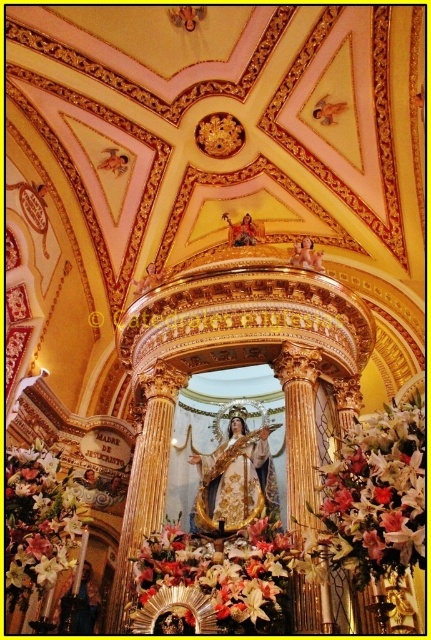
Who is positioned more to the right, floral bouquet at center or white silk flower at lower left?

floral bouquet at center is more to the right.

Who is more distant from viewer, (159, 600) or (53, 577)?

The point (53, 577) is behind.

Find the location of a particular element. The height and width of the screenshot is (640, 431). floral bouquet at center is located at coordinates (x=214, y=580).

Is white silk flowers at right bigger than floral bouquet at center?

Indeed, white silk flowers at right has a larger size compared to floral bouquet at center.

How far apart are white silk flowers at right and floral bouquet at center?

A distance of 10.12 meters exists between white silk flowers at right and floral bouquet at center.

Measure the distance between white silk flowers at right and camera.

white silk flowers at right is 34.71 meters from camera.

In order to click on white silk flowers at right in this screenshot , I will do `click(377, 493)`.

Is white silk flowers at right further to the viewer compared to white silk flower at lower left?

No, it is in front of white silk flower at lower left.

Image resolution: width=431 pixels, height=640 pixels. I want to click on white silk flowers at right, so click(377, 493).

Where is `white silk flowers at right`? This screenshot has height=640, width=431. white silk flowers at right is located at coordinates (377, 493).